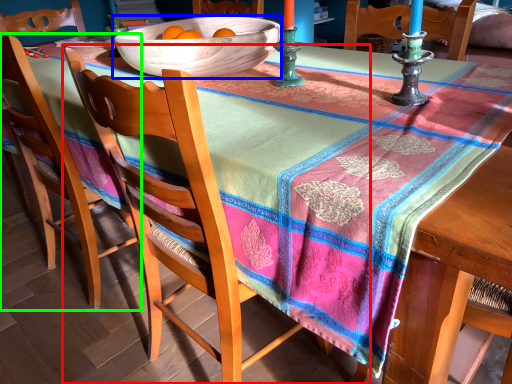
Question: Considering the real-world distances, which object is farthest from chair (highlighted by a red box)? bowl (highlighted by a blue box) or chair (highlighted by a green box)?

Choices:
 (A) bowl
 (B) chair

Answer: (B)